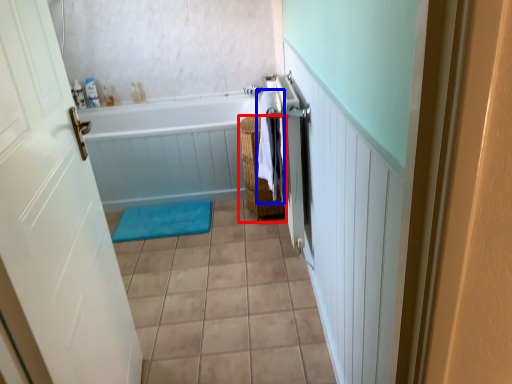
Question: Which object is closer to the camera taking this photo, basket (highlighted by a red box) or beach towel (highlighted by a blue box)?

Choices:
 (A) basket
 (B) beach towel

Answer: (B)